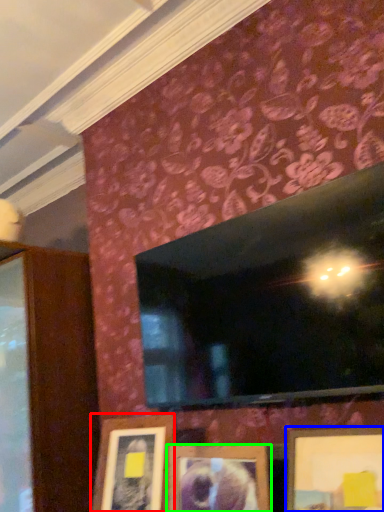
Question: Which object is the closest to the picture frame (highlighted by a red box)? Choose among these: picture frame (highlighted by a blue box) or picture frame (highlighted by a green box).

Choices:
 (A) picture frame
 (B) picture frame

Answer: (B)